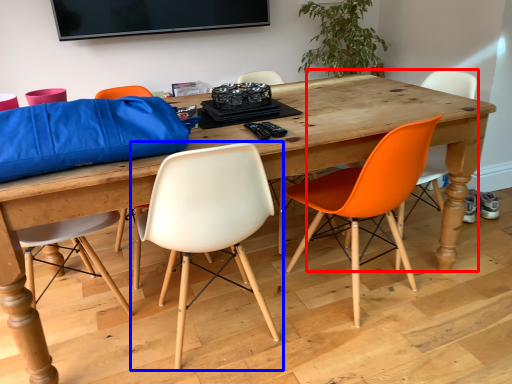
Question: Which of the following is the closest to the observer, chair (highlighted by a red box) or chair (highlighted by a blue box)?

Choices:
 (A) chair
 (B) chair

Answer: (B)